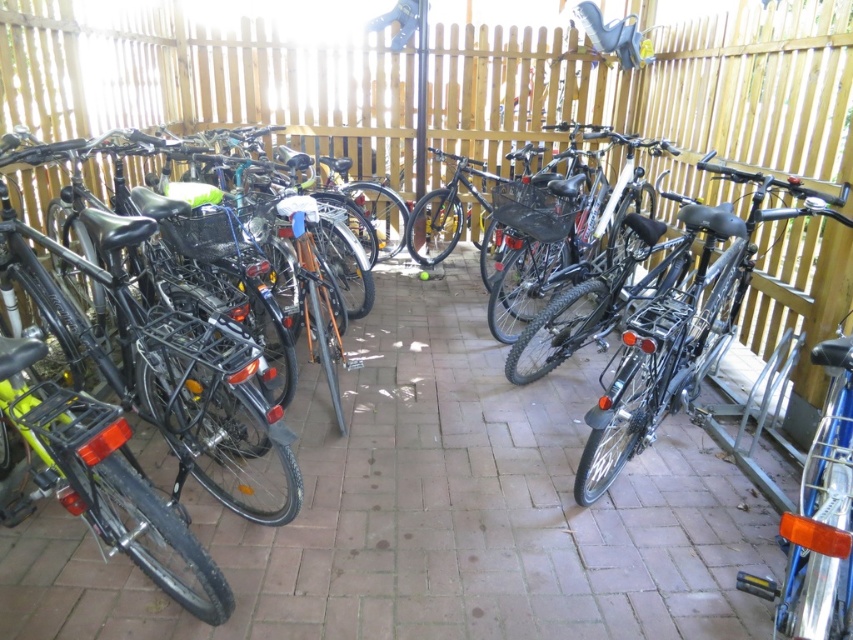
You are a delivery person who needs to choose between the shiny black bicycle at right and the shiny silver bicycle at right. Which bicycle should you choose if you want the larger one?

The shiny black bicycle at right is bigger than the shiny silver bicycle at right, so you should choose the shiny black bicycle at right.

You are standing in the bicycle parking area and want to determine which of the two points, point (625,435) or point (822,346), is closer to you. Based on the image, which point is nearer?

Point (625,435) is closer to you because it is further to the viewer than point (822,346).